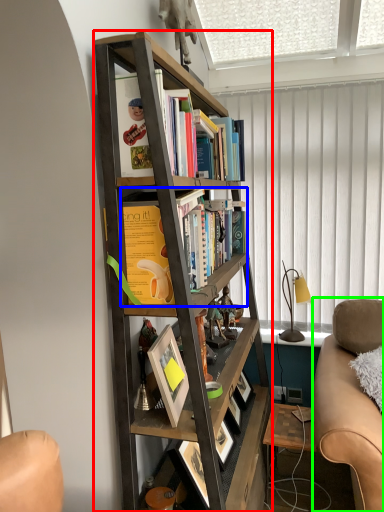
Question: Based on their relative distances, which object is farther from bookcase (highlighted by a red box)? Choose from book (highlighted by a blue box) and studio couch (highlighted by a green box).

Choices:
 (A) book
 (B) studio couch

Answer: (B)